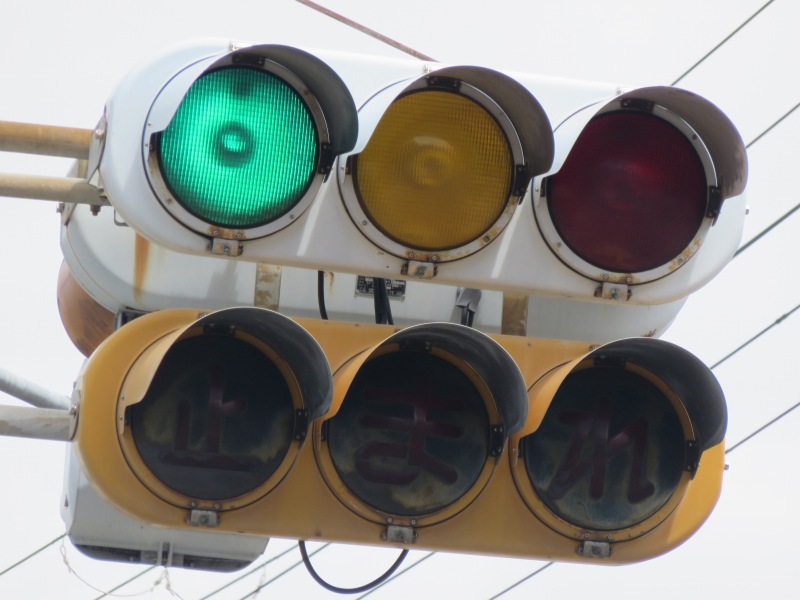
Where is `power cords`? The height and width of the screenshot is (600, 800). power cords is located at coordinates (758, 426).